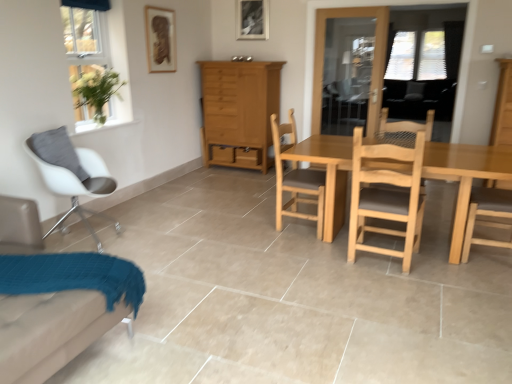
Question: Would you say light brown wood cabinet at center is to the left or to the right of clear glass window at upper left in the picture?

Choices:
 (A) right
 (B) left

Answer: (A)

Question: From the image's perspective, is light brown wood cabinet at center above or below clear glass window at upper left?

Choices:
 (A) below
 (B) above

Answer: (A)

Question: Which object is positioned farthest from the natural wood chair at center, positioned as the first chair in right-to-left order?

Choices:
 (A) light brown wood chair at center, placed as the second chair when sorted from right to left
 (B) metallic silver picture frame at upper center, which is the 1th picture frame in back-to-front order
 (C) light wood dresser at right
 (D) white fabric chair at lower left, arranged as the second chair when viewed from the left
 (E) white matte chair at left, which appears as the first chair when viewed from the left

Answer: (B)

Question: Which object is the farthest from the light wood dresser at right?

Choices:
 (A) white matte chair at left, which is the fourth chair in right-to-left order
 (B) white fabric chair at lower left, the 3th chair when ordered from right to left
 (C) light brown wood chair at center, placed as the second chair when sorted from right to left
 (D) natural wood chair at center, marked as the fourth chair in a left-to-right arrangement
 (E) metallic silver picture frame at upper center, which is the 1th picture frame in top-to-bottom order

Answer: (B)